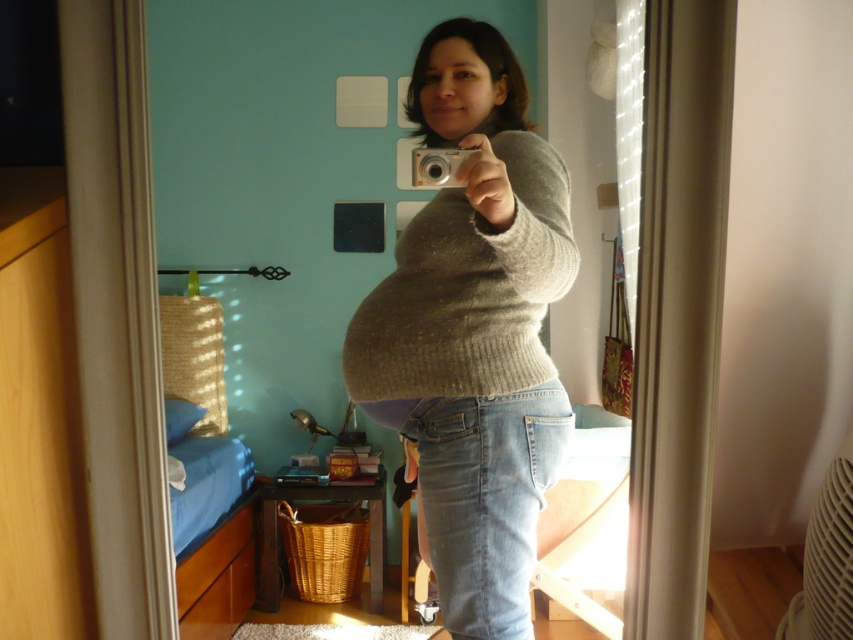
You are a photographer trying to capture the reflection in the mirror. The denim jeans at lower center and the silver metallic camera at center are both in your shot. Which object will appear bigger in the photo?

The denim jeans at lower center will appear bigger in the photo since it has a larger size compared to the silver metallic camera at center.